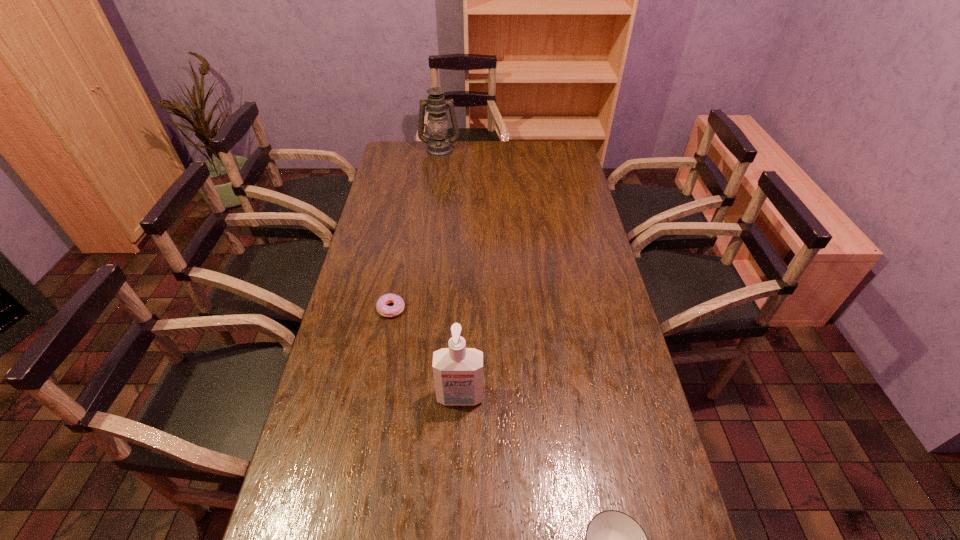
The width and height of the screenshot is (960, 540). In order to click on vacant space that satisfies the following two spatial constraints: 1. on the back side of the farthest object; 2. on the right side of the shortest object in this screenshot , I will do `click(420, 150)`.